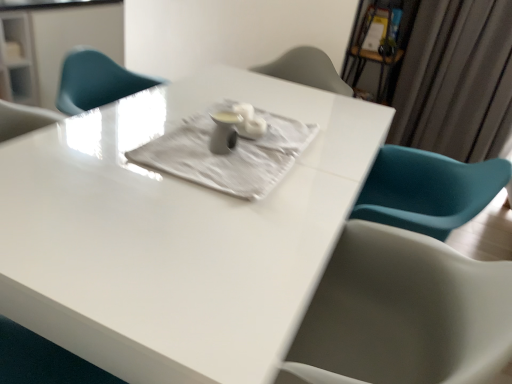
Question: Is white glossy table at center bigger than silky gray curtain at upper right?

Choices:
 (A) yes
 (B) no

Answer: (A)

Question: Can you confirm if white glossy table at center is positioned to the left of silky gray curtain at upper right?

Choices:
 (A) no
 (B) yes

Answer: (B)

Question: Does white glossy table at center have a lesser height compared to silky gray curtain at upper right?

Choices:
 (A) no
 (B) yes

Answer: (B)

Question: Considering the relative positions of white glossy table at center and silky gray curtain at upper right in the image provided, is white glossy table at center to the right of silky gray curtain at upper right from the viewer's perspective?

Choices:
 (A) no
 (B) yes

Answer: (A)

Question: Does white glossy table at center have a greater height compared to silky gray curtain at upper right?

Choices:
 (A) yes
 (B) no

Answer: (B)

Question: Could you tell me if white glossy table at center is turned towards silky gray curtain at upper right?

Choices:
 (A) no
 (B) yes

Answer: (A)

Question: Is white glossy table at center shorter than white textured cloth at center?

Choices:
 (A) yes
 (B) no

Answer: (B)

Question: Is white glossy table at center facing towards white textured cloth at center?

Choices:
 (A) no
 (B) yes

Answer: (A)

Question: Are white glossy table at center and white textured cloth at center far apart?

Choices:
 (A) no
 (B) yes

Answer: (A)

Question: Is white glossy table at center at the right side of white textured cloth at center?

Choices:
 (A) no
 (B) yes

Answer: (A)

Question: Is white glossy table at center facing away from white textured cloth at center?

Choices:
 (A) yes
 (B) no

Answer: (B)

Question: From a real-world perspective, does white glossy table at center stand above white textured cloth at center?

Choices:
 (A) yes
 (B) no

Answer: (B)

Question: From the image's perspective, is silky gray curtain at upper right located above white glossy table at center?

Choices:
 (A) no
 (B) yes

Answer: (B)